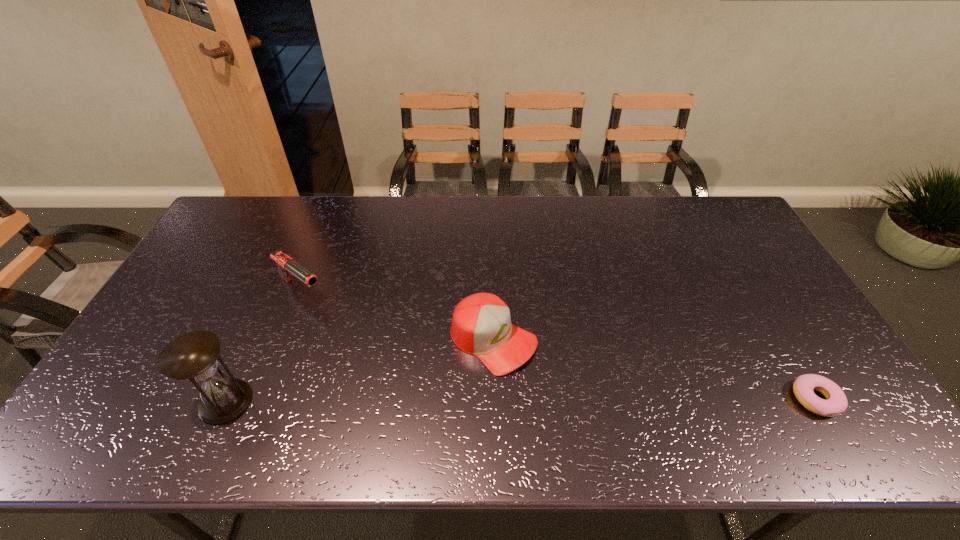
Find the location of a particular element. This screenshot has height=540, width=960. free spot between the tallest object and the baseball cap is located at coordinates (360, 370).

At what (x,y) coordinates should I click in order to perform the action: click on free space between the gun and the hourglass. Please return your answer as a coordinate pair (x, y). The image size is (960, 540). Looking at the image, I should click on (264, 346).

This screenshot has height=540, width=960. In order to click on the third closest object to the rightmost object in this screenshot , I will do point(193,356).

Select which object appears as the second closest to the hourglass. Please provide its 2D coordinates. Your answer should be formatted as a tuple, i.e. [(x, y)], where the tuple contains the x and y coordinates of a point satisfying the conditions above.

[(481, 324)]

The height and width of the screenshot is (540, 960). What are the coordinates of `vacant area that satisfies the following two spatial constraints: 1. on the back side of the rightmost object; 2. on the left side of the tallest object` in the screenshot? It's located at (227, 399).

Locate an element on the screen. free spot that satisfies the following two spatial constraints: 1. on the front side of the gun; 2. on the right side of the baseball cap is located at coordinates (282, 340).